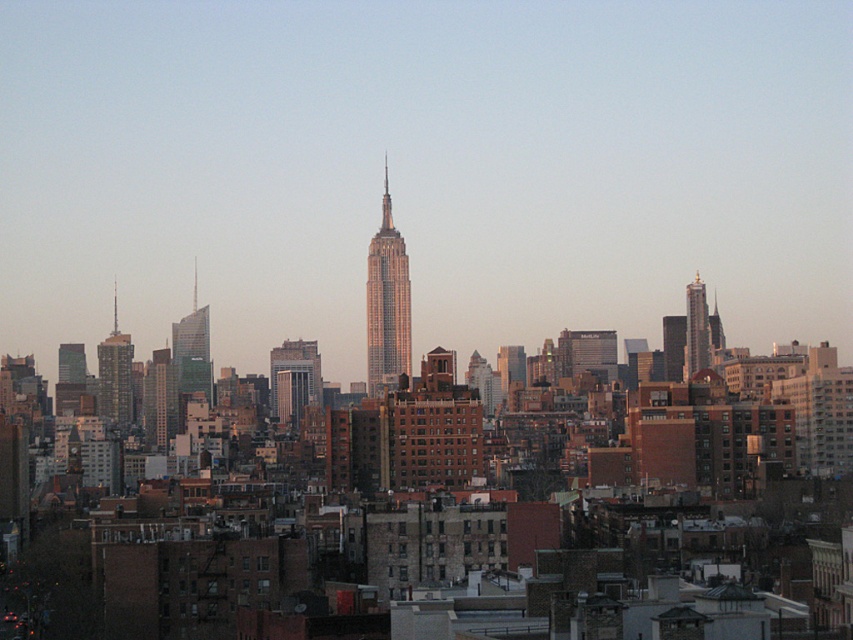
You are a city planner analyzing the skyline. You need to determine which of the two skyscrapers, the shiny glass skyscraper at center or the gold reflective skyscraper at right, has a larger footprint in terms of width. Based on the scene, which one is wider?

The shiny glass skyscraper at center is wider than the gold reflective skyscraper at right.